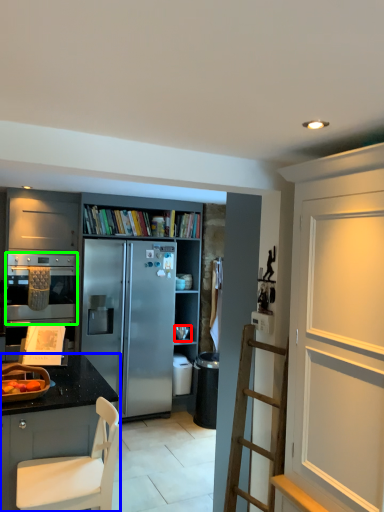
Question: Which is nearer to the appliance (highlighted by a red box)? cabinetry (highlighted by a blue box) or oven (highlighted by a green box).

Choices:
 (A) cabinetry
 (B) oven

Answer: (B)